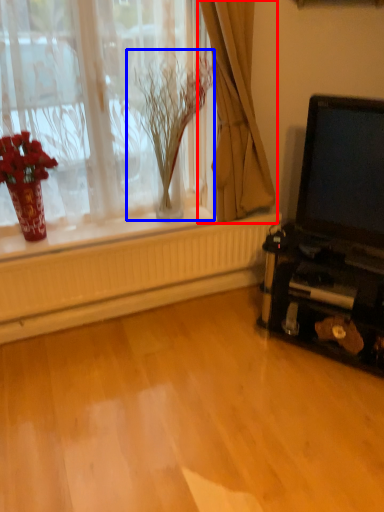
Question: Which of the following is the closest to the observer, curtain (highlighted by a red box) or plant (highlighted by a blue box)?

Choices:
 (A) curtain
 (B) plant

Answer: (A)